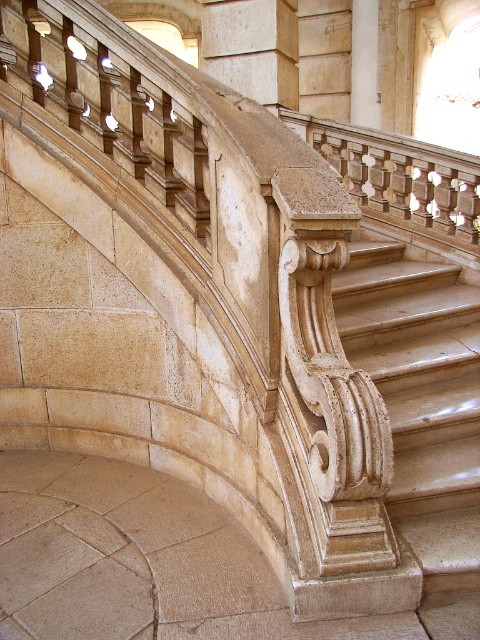
You are an architect assessing the layout of this grand staircase. You need to determine the spatial relationship between the polished beige marble stairs at center and the wooden carved column at upper center. From the observer standing at the bottom of the stairs, which object is positioned to the right?

The polished beige marble stairs at center are to the right of the wooden carved column at upper center from the observer standing at the bottom of the stairs.

From the picture: You are an architect designing a new building and want to ensure accessibility for all visitors. You need to install a ramp that connects the polished beige marble stairs at center to the wooden carved column at upper center. Considering their heights, will the ramp need to be steep or gentle?

The polished beige marble stairs at center is much taller than the wooden carved column at upper center. Therefore, the ramp will need to be gentle to accommodate the height difference between the two structures.

You are a maintenance worker needing to reach the wooden carved column at upper center from the polished beige marble stairs at center. Given that your ladder is 7 feet long, will it be sufficient to reach the column?

The distance between the polished beige marble stairs at center and the wooden carved column at upper center is 8.04 feet. Since the ladder is only 7 feet long, it will not be sufficient to reach the column.